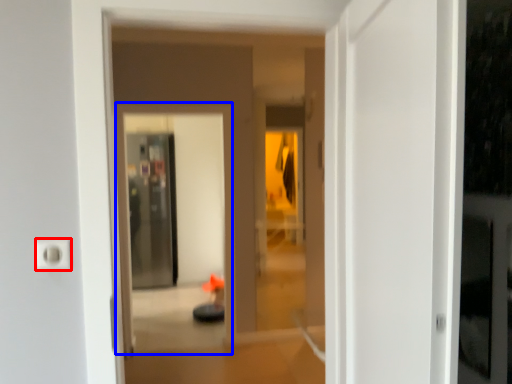
Question: Which object is further to the camera taking this photo, electric outlet (highlighted by a red box) or screen door (highlighted by a blue box)?

Choices:
 (A) electric outlet
 (B) screen door

Answer: (B)